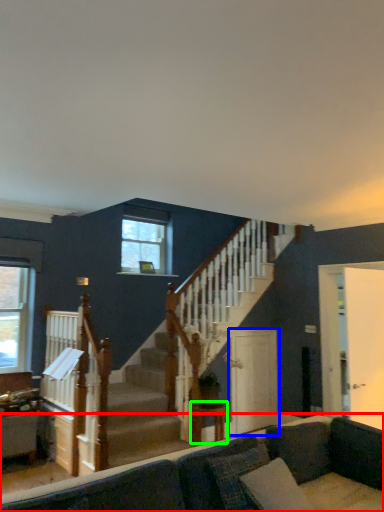
Question: Which object is the farthest from studio couch (highlighted by a red box)? Choose among these: screen door (highlighted by a blue box) or table (highlighted by a green box).

Choices:
 (A) screen door
 (B) table

Answer: (A)